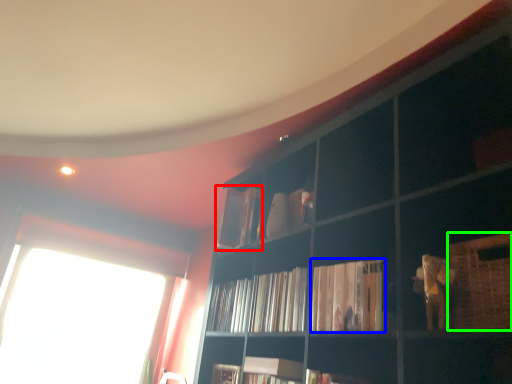
Question: Considering the real-world distances, which object is farthest from book (highlighted by a red box)? book (highlighted by a blue box) or basket (highlighted by a green box)?

Choices:
 (A) book
 (B) basket

Answer: (B)